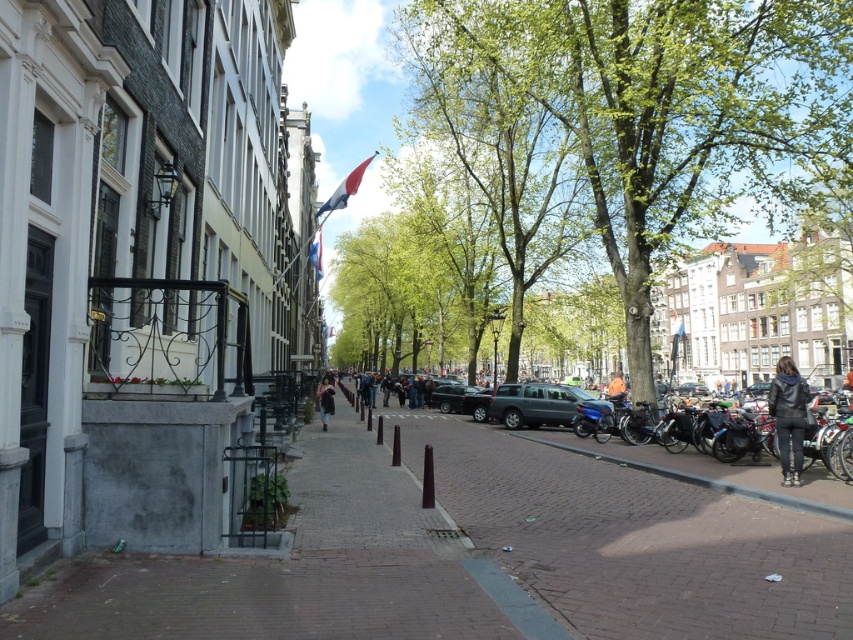
You are a city planner analyzing this street scene. You need to determine which object occupies more space in the central area of the image. Which one is larger in size between the green leafy tree at center and the brick pavement at center?

The green leafy tree at center is larger in size than the brick pavement at center according to the description.

You are standing on the street in the image and want to walk from point A to point B. Point A is at coordinate point(723, 26) and point B is at coordinate point(589, 612). Which direction should you head to reach point B from point A?

Since point A is further to the viewer than point B, you should head towards the direction away from you to reach point B from point A.